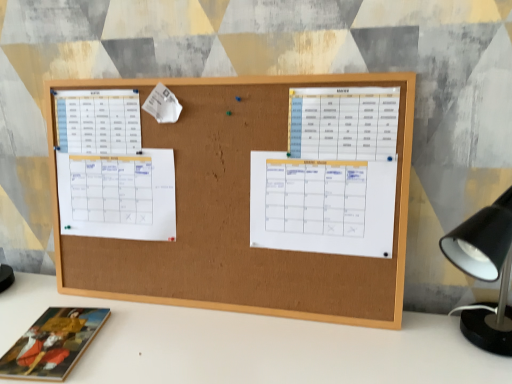
At what (x,y) coordinates should I click in order to perform the action: click on blank space situated above wooden book at lower left (from a real-world perspective). Please return your answer as a coordinate pair (x, y). This screenshot has height=384, width=512. Looking at the image, I should click on pyautogui.click(x=53, y=333).